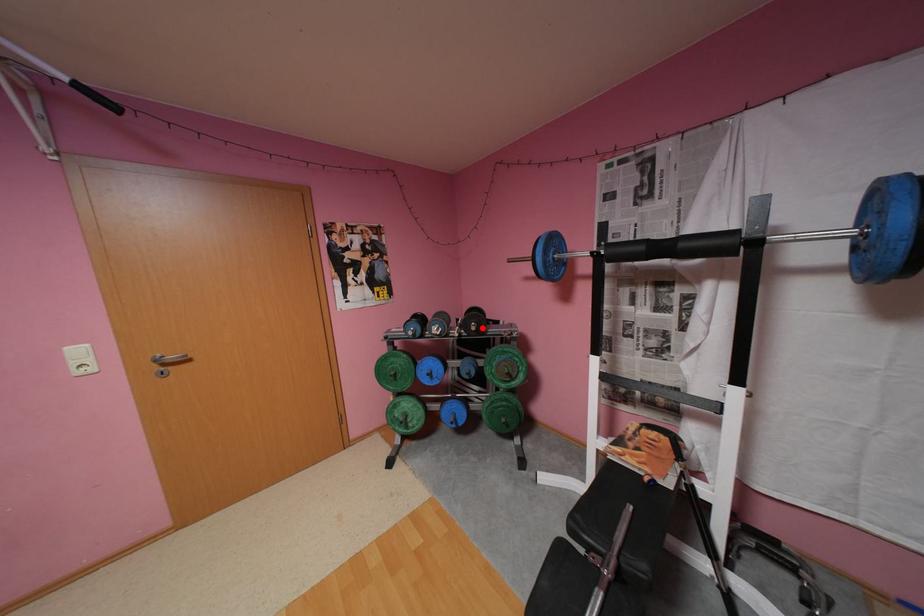
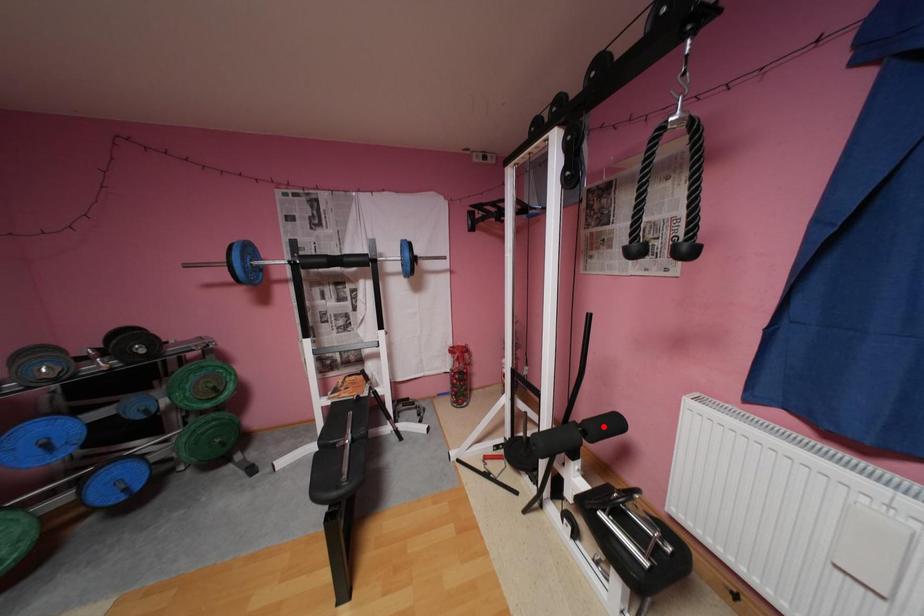
I am providing you with two images of the same scene from different viewpoints. A red point is marked on the first image and another point is marked on the second image. Is the red point in image1 aligned with the point shown in image2?

No